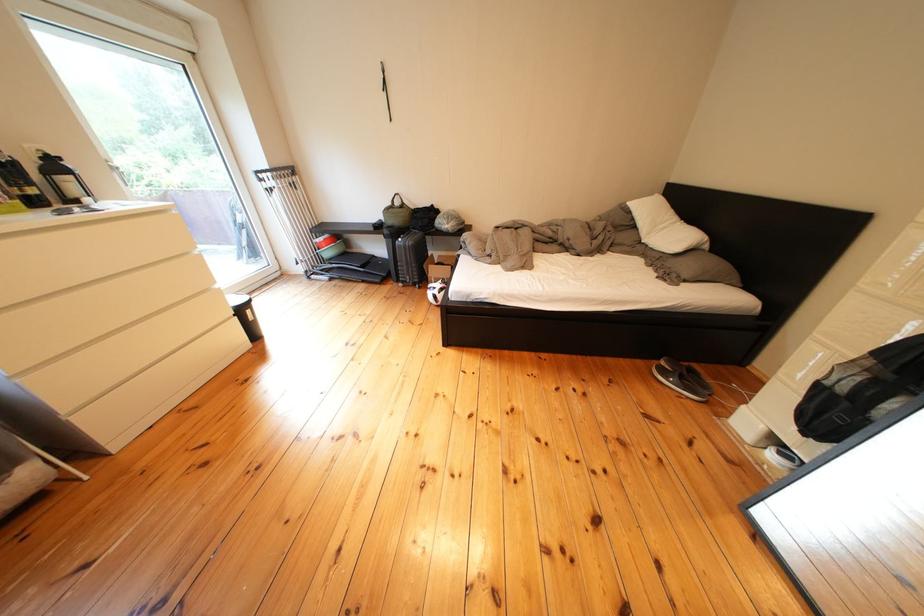
The location [435,291] corresponds to which object?

This point indicates the white soccer ball.